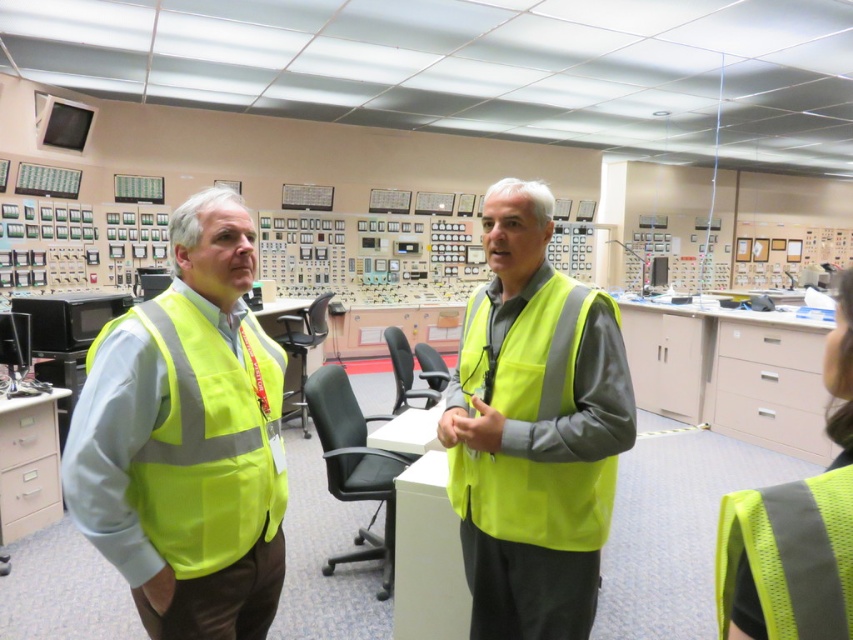
Between point (184, 413) and point (535, 500), which one is positioned in front?

Positioned in front is point (184, 413).

Who is higher up, high-visibility fabric safety vest at left or high-visibility fabric safety vest at center?

high-visibility fabric safety vest at center is above.

Does point (196, 461) come farther from viewer compared to point (479, 285)?

No, (196, 461) is in front of (479, 285).

Where is `high-visibility fabric safety vest at left`? high-visibility fabric safety vest at left is located at coordinates (x=207, y=438).